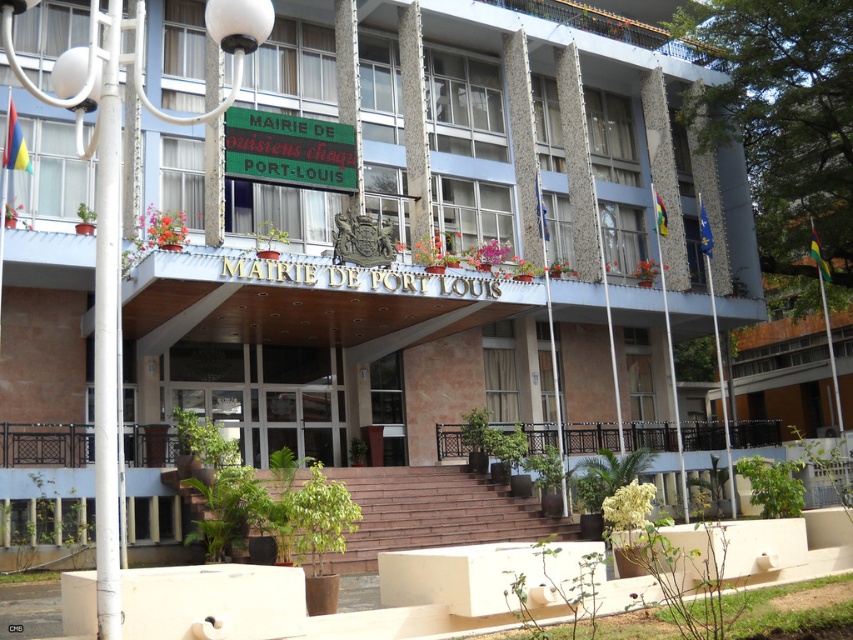
Question: In this image, where is transparent glass doors at center located relative to green plastic sign at upper center?

Choices:
 (A) left
 (B) right

Answer: (A)

Question: Does transparent glass doors at center appear over green plastic sign at upper center?

Choices:
 (A) yes
 (B) no

Answer: (B)

Question: Is transparent glass doors at center further to the viewer compared to green plastic sign at upper center?

Choices:
 (A) yes
 (B) no

Answer: (A)

Question: Which object appears closest to the camera in this image?

Choices:
 (A) transparent glass doors at center
 (B) green plastic sign at upper center

Answer: (B)